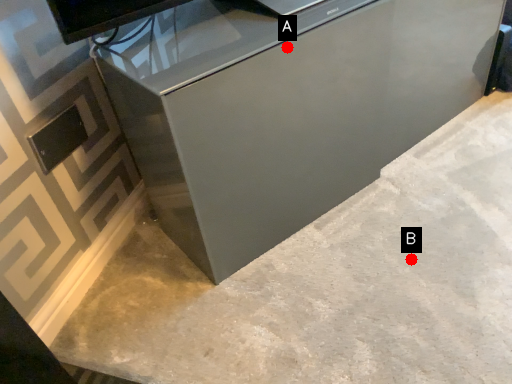
Question: Two points are circled on the image, labeled by A and B beside each circle. Among these points, which one is farthest from the camera?

Choices:
 (A) A is further
 (B) B is further

Answer: (B)